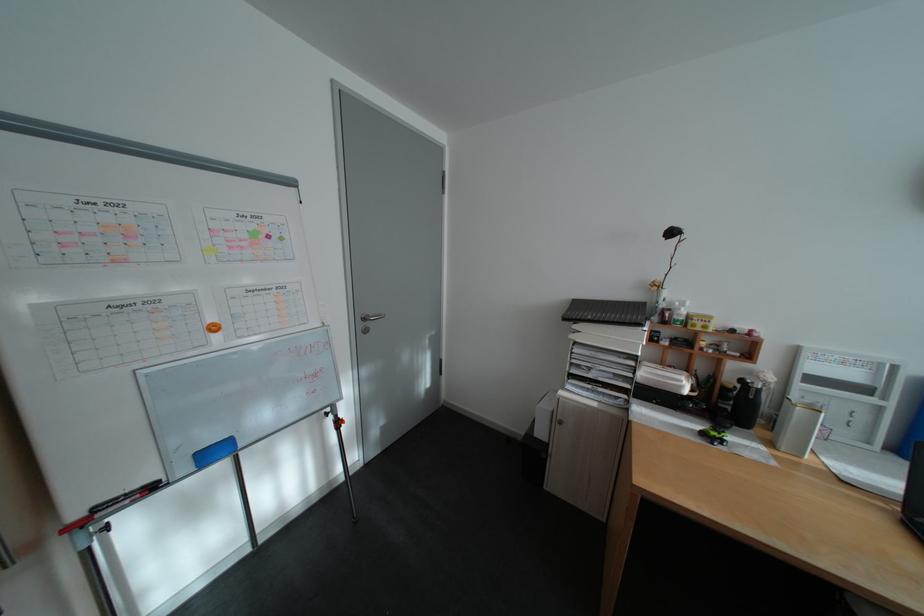
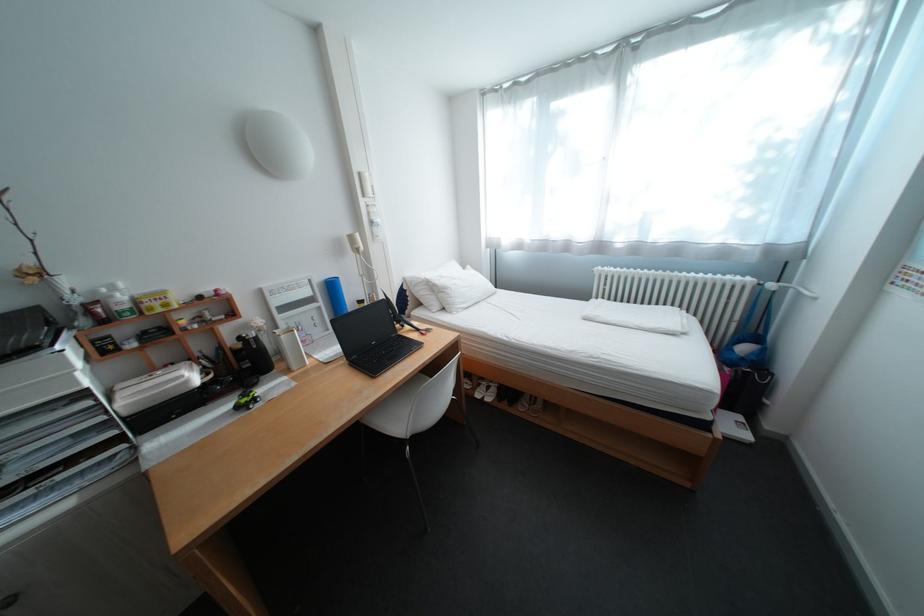
The images are taken continuously from a first-person perspective. In which direction is your viewpoint rotating?

The camera rotated toward right-down.